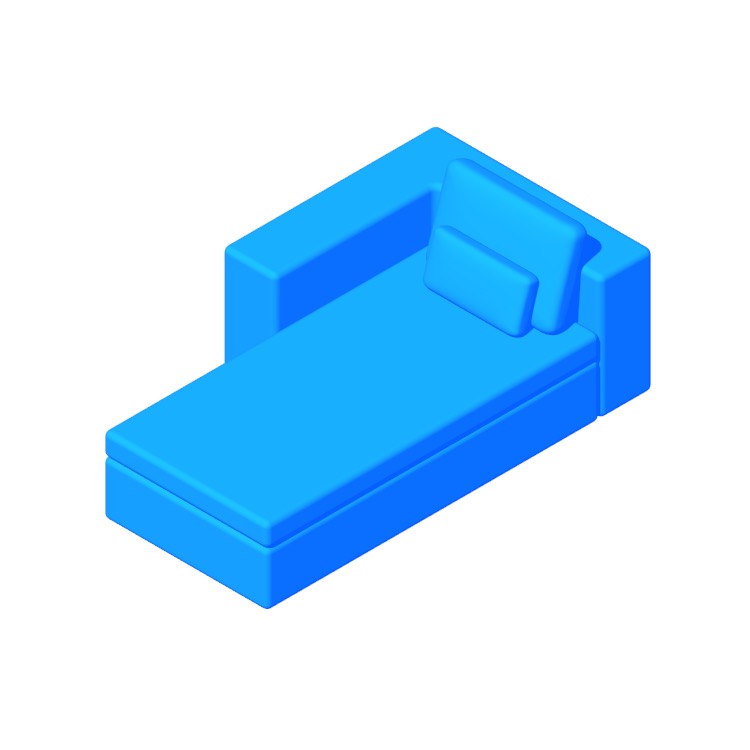
You are a GUI agent. You are given a task and a screenshot of the screen. Output one action in this format:
    pyautogui.click(x=<x>, y=<y>)
    Task: Click on the space to the right of couch
    Image resolution: width=750 pixels, height=750 pixels.
    Given the screenshot: What is the action you would take?
    pyautogui.click(x=568, y=460)